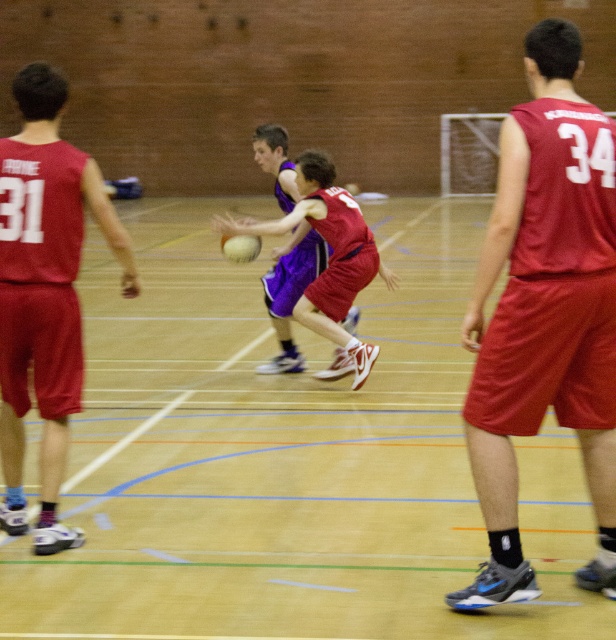
You are a spectator at the basketball game. You notice a point marked at coordinates (545,312) on the court. What object is located at that specific coordinate?

The point at coordinates (545,312) is occupied by a matte red jersey at right.

You are a referee standing at the center of the basketball court. You need to quickly locate the matte red jersey at left. Based on the court coordinates, where should you look relative to your position?

The matte red jersey at left is located at point 0.455 on the x and 0.073 on the y coordinates, so you should look towards the lower left direction from your position at the center of the court.

You are a photographer standing at the back of the gymnasium and want to take a photo of both the matte red jersey at right and the matte red jersey at left. Which player should you focus on first if you want to capture both in the frame without zooming in or out?

The matte red jersey at right occupies less space than the matte red jersey at left, so you should focus on the matte red jersey at left first to ensure both are in the frame without needing to adjust the zoom.